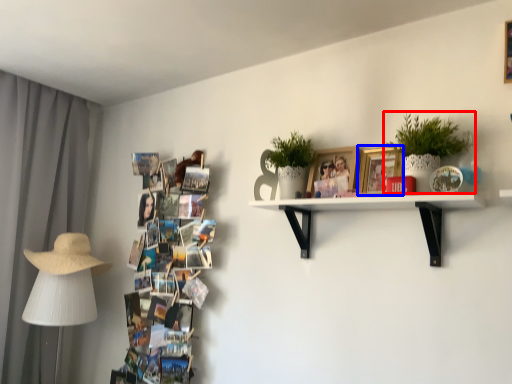
Question: Which object appears farthest to the camera in this image, houseplant (highlighted by a red box) or picture frame (highlighted by a blue box)?

Choices:
 (A) houseplant
 (B) picture frame

Answer: (B)